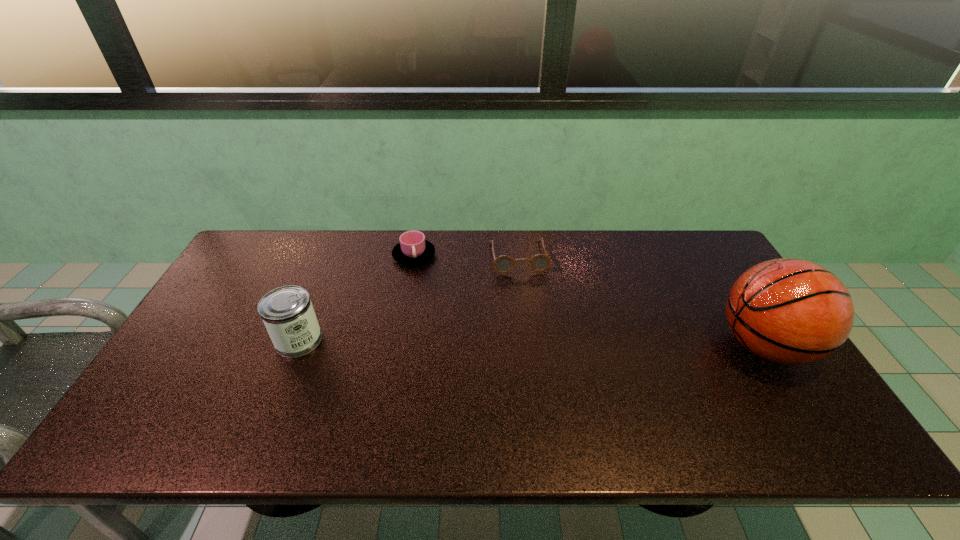
Where is `vacant area situated 0.280m on the front-facing side of the spectacles`? This screenshot has width=960, height=540. vacant area situated 0.280m on the front-facing side of the spectacles is located at coordinates (536, 342).

I want to click on vacant space located on the front-facing side of the spectacles, so click(525, 290).

Where is `vacant space located on the front-facing side of the spectacles`? The height and width of the screenshot is (540, 960). vacant space located on the front-facing side of the spectacles is located at coordinates (531, 321).

This screenshot has width=960, height=540. In order to click on free point located on the side with the handle of the third object from right to left in this screenshot , I will do `click(437, 289)`.

Find the location of a particular element. This screenshot has width=960, height=540. vacant position located 0.160m on the side with the handle of the third object from right to left is located at coordinates (443, 298).

Locate an element on the screen. Image resolution: width=960 pixels, height=540 pixels. vacant space positioned on the side with the handle of the third object from right to left is located at coordinates (432, 282).

This screenshot has width=960, height=540. I want to click on spectacles that is at the far edge, so click(503, 264).

The width and height of the screenshot is (960, 540). I want to click on cup at the far edge, so click(x=413, y=249).

The height and width of the screenshot is (540, 960). I want to click on object that is at the near edge, so click(x=789, y=311).

Locate an element on the screen. object that is at the right edge is located at coordinates (789, 311).